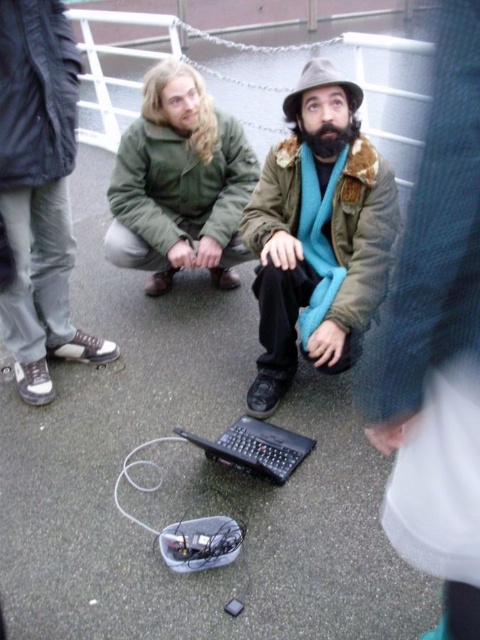
Who is more distant from viewer, (118, 276) or (189, 124)?

The point (118, 276) is more distant.

Is point (262, 483) positioned after point (191, 157)?

No.

The height and width of the screenshot is (640, 480). In order to click on black plastic laptop at center in this screenshot , I will do `click(186, 477)`.

Who is lower down, black plastic laptop at center or matte brown jacket at center?

black plastic laptop at center is below.

Can you confirm if black plastic laptop at center is bigger than matte brown jacket at center?

Indeed, black plastic laptop at center has a larger size compared to matte brown jacket at center.

The image size is (480, 640). Find the location of `black plastic laptop at center`. black plastic laptop at center is located at coordinates (186, 477).

Locate an element on the screen. black plastic laptop at center is located at coordinates (186, 477).

How much distance is there between matte brown jacket at center and green matte jacket at center?

matte brown jacket at center and green matte jacket at center are 27.45 inches apart from each other.

Who is positioned more to the right, matte brown jacket at center or green matte jacket at center?

Positioned to the right is matte brown jacket at center.

Image resolution: width=480 pixels, height=640 pixels. In order to click on matte brown jacket at center in this screenshot , I will do `click(317, 234)`.

Locate an element on the screen. Image resolution: width=480 pixels, height=640 pixels. matte brown jacket at center is located at coordinates (317, 234).